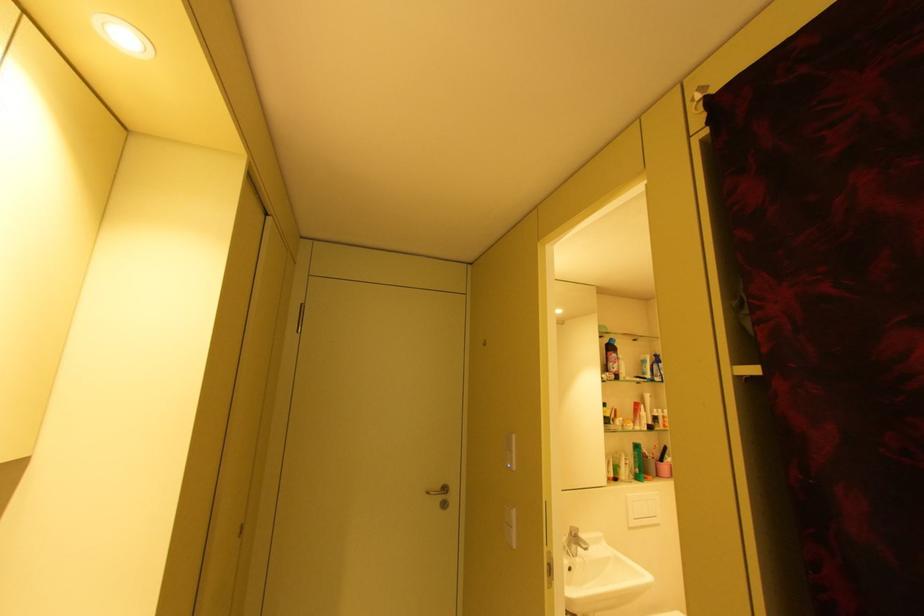
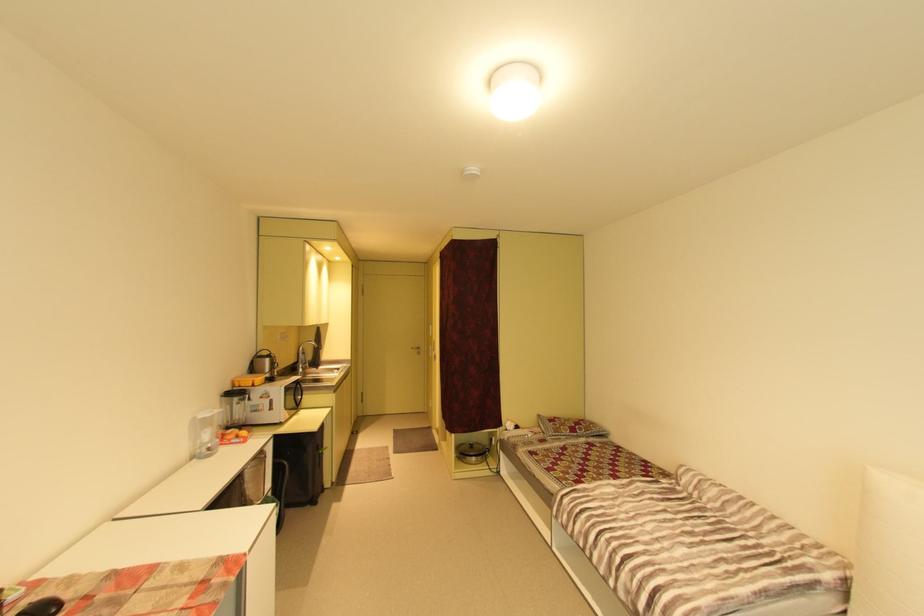
In the second image, find the point that corresponds to [434,493] in the first image.

(419, 349)